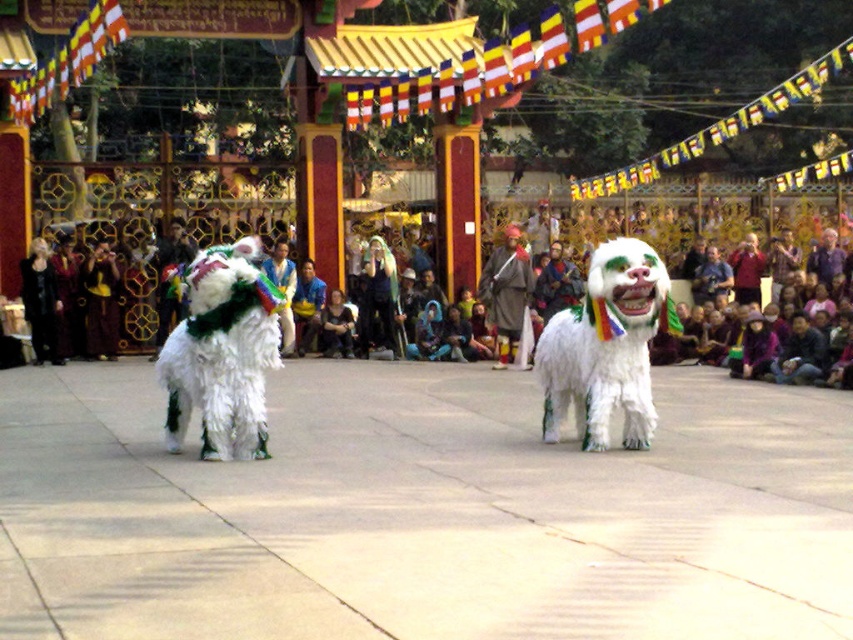
Image resolution: width=853 pixels, height=640 pixels. What do you see at coordinates (508, 296) in the screenshot?
I see `matte green costume at center` at bounding box center [508, 296].

Describe the element at coordinates (508, 296) in the screenshot. I see `matte green costume at center` at that location.

Where is `matte green costume at center`? Image resolution: width=853 pixels, height=640 pixels. matte green costume at center is located at coordinates (508, 296).

How distant is matte green costume at center from green fuzzy costume at center?

They are 3.80 meters apart.

Who is more distant from viewer, (506, 332) or (299, 342)?

Positioned behind is point (299, 342).

Who is more forward, (502, 364) or (296, 326)?

Point (502, 364)

Locate an element on the screen. matte green costume at center is located at coordinates (508, 296).

Between matte green costume at center and white fur costume at center, which one is positioned higher?

white fur costume at center is above.

Between matte green costume at center and white fur costume at center, which one appears on the left side from the viewer's perspective?

Positioned to the left is white fur costume at center.

Describe the element at coordinates (508, 296) in the screenshot. This screenshot has height=640, width=853. I see `matte green costume at center` at that location.

The image size is (853, 640). Identify the location of matte green costume at center. (508, 296).